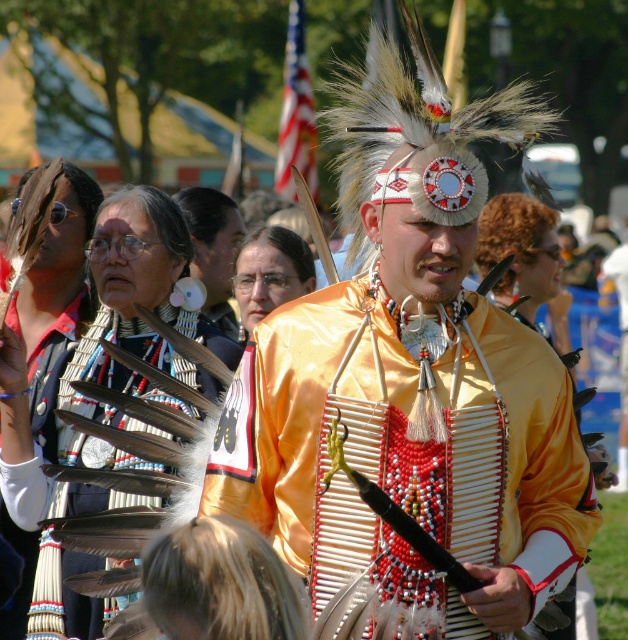
Locate an element on the screen. This screenshot has height=640, width=628. feathered vest at center is located at coordinates (126, 372).

Based on the photo, who is positioned more to the right, feathered vest at center or matte black feather at center?

matte black feather at center

Find the location of `feathered vest at center`. feathered vest at center is located at coordinates (126, 372).

Between satin yellow vest at center and feathered vest at center, which one has more height?

Standing taller between the two is satin yellow vest at center.

What do you see at coordinates (404, 445) in the screenshot? I see `satin yellow vest at center` at bounding box center [404, 445].

Locate an element on the screen. satin yellow vest at center is located at coordinates (404, 445).

Between satin yellow vest at center and feathered headdress at upper center, which one has less height?

feathered headdress at upper center

Is satin yellow vest at center closer to the viewer compared to feathered headdress at upper center?

Yes, satin yellow vest at center is in front of feathered headdress at upper center.

Between point (455, 540) and point (85, 285), which one is positioned behind?

The point (85, 285) is more distant.

I want to click on satin yellow vest at center, so click(x=404, y=445).